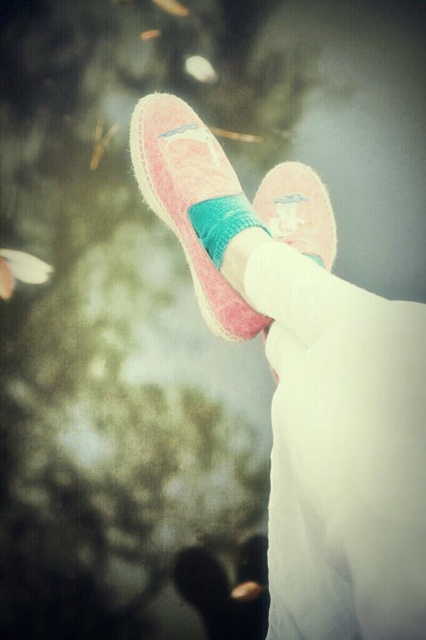
Question: Which point is farther to the camera?

Choices:
 (A) (391, 529)
 (B) (189, 157)
 (C) (250, 596)

Answer: (C)

Question: Is pink suede shoes at center wider than pink suede toe at lower center?

Choices:
 (A) no
 (B) yes

Answer: (B)

Question: Which object is positioned farthest from the pink suede shoes at center?

Choices:
 (A) pink suede shoe at center
 (B) pink suede toe at lower center
 (C) teal soft sock at center

Answer: (B)

Question: Estimate the real-world distances between objects in this image. Which object is farther from the pink suede shoes at center?

Choices:
 (A) teal soft sock at center
 (B) pink suede shoe at center
 (C) pink suede toe at lower center

Answer: (C)

Question: Can you confirm if pink suede shoe at center is thinner than pink suede toe at lower center?

Choices:
 (A) yes
 (B) no

Answer: (B)

Question: Observing the image, what is the correct spatial positioning of pink suede shoes at center in reference to teal soft sock at center?

Choices:
 (A) below
 (B) above

Answer: (A)